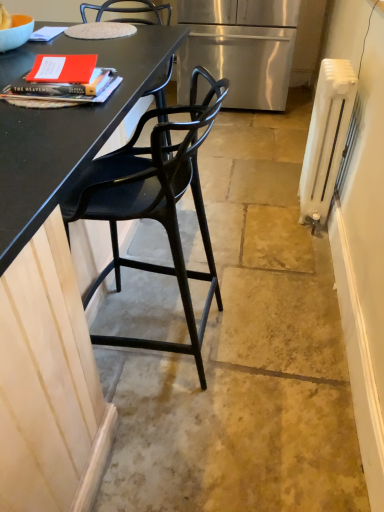
What are the coordinates of `unoccupied area in front of black matte chair at left` in the screenshot? It's located at (185, 448).